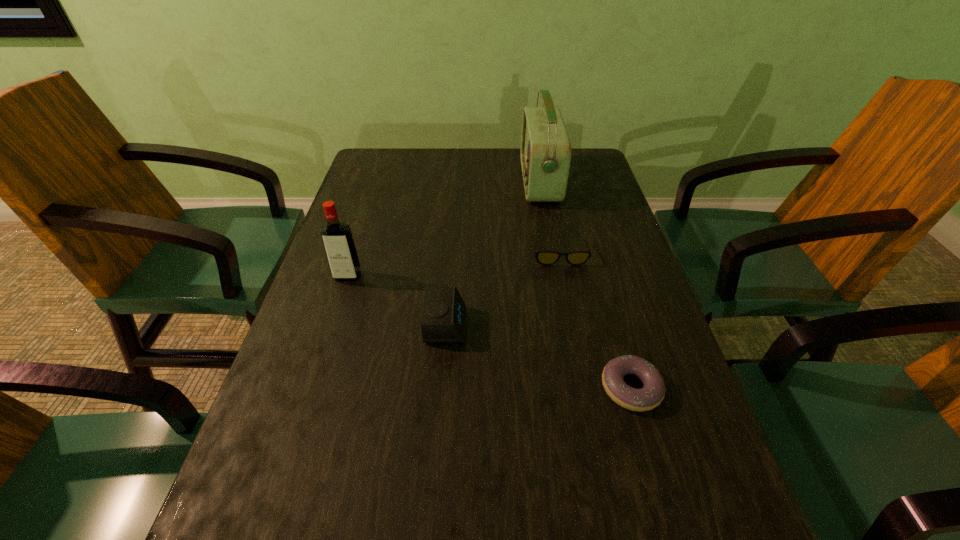
Locate an element on the screen. The height and width of the screenshot is (540, 960). the tallest object is located at coordinates 545,154.

Locate an element on the screen. The width and height of the screenshot is (960, 540). the farthest object is located at coordinates (545, 154).

Where is `vodka`? vodka is located at coordinates (339, 245).

I want to click on the third farthest object, so click(339, 245).

This screenshot has height=540, width=960. In order to click on the fourth farthest object in this screenshot , I will do coord(443,320).

Find the location of a particular element. The height and width of the screenshot is (540, 960). the second object from left to right is located at coordinates (443, 320).

Locate an element on the screen. the fourth nearest object is located at coordinates (543, 257).

The image size is (960, 540). I want to click on doughnut, so click(651, 395).

The width and height of the screenshot is (960, 540). Identify the location of vacant area situated 0.080m on the front panel of the radio receiver. (494, 182).

You are a GUI agent. You are given a task and a screenshot of the screen. Output one action in this format:
    pyautogui.click(x=<x>, y=<y>)
    Task: Click on the vacant space situated 0.180m on the front panel of the radio receiver
    The width and height of the screenshot is (960, 540).
    Given the screenshot: What is the action you would take?
    pyautogui.click(x=462, y=182)